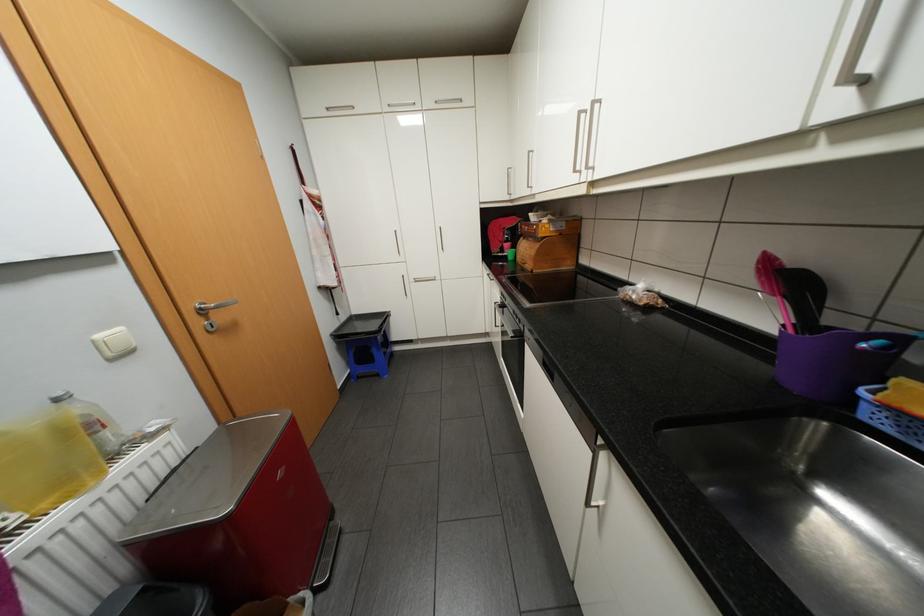
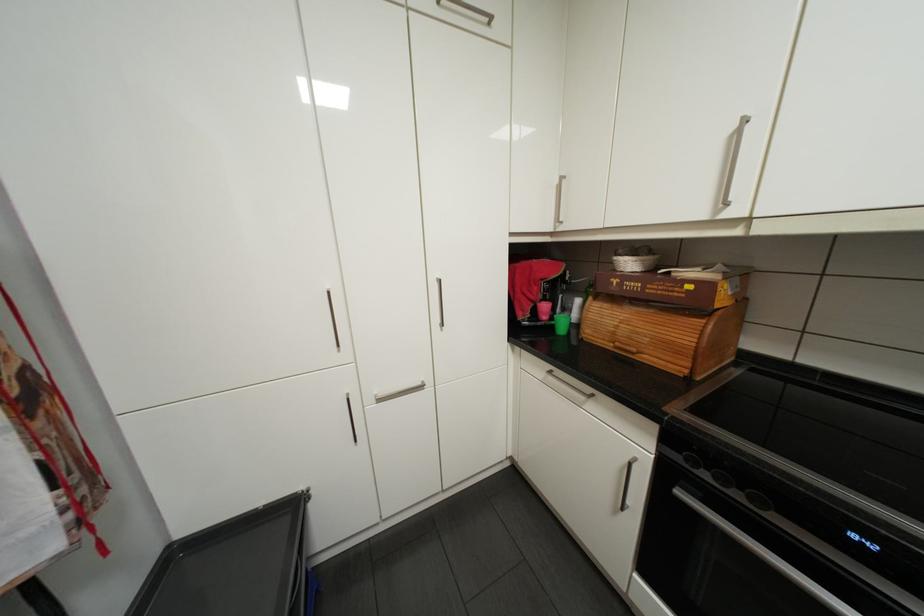
In the second image, find the point that corresponds to [531,237] in the first image.

(602, 297)